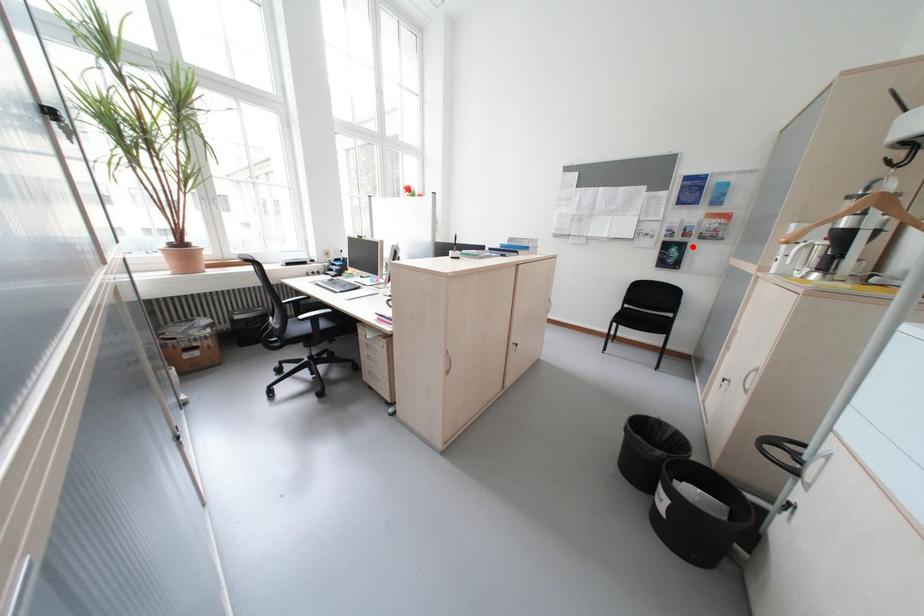
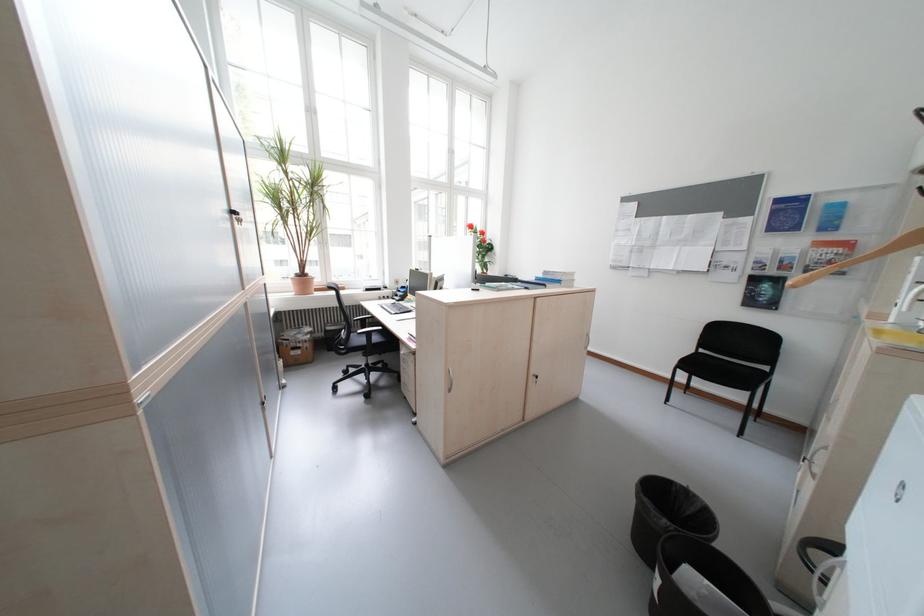
Find the pixel in the second image that matches the highlighted location in the first image.

(788, 282)